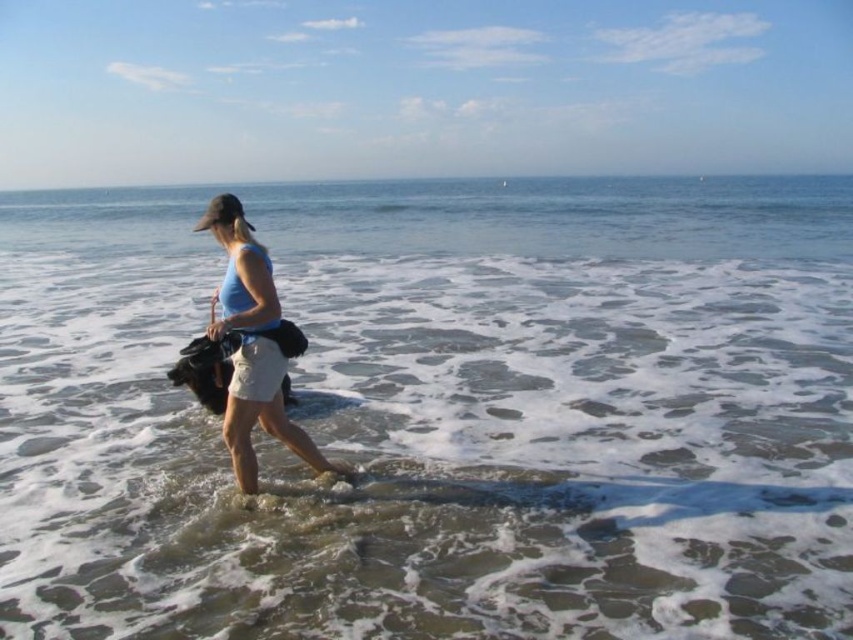
You are a photographer trying to capture a candid shot of the person walking on the beach. You need to ensure that both the clear water at center and the light beige cotton skirt at center are visible in the frame. Given their widths, which object will occupy more horizontal space in your photo?

The clear water at center will occupy more horizontal space in the photo because its width surpasses that of the light beige cotton skirt at center.

You are a photographer trying to capture the reflection of the person on the beach in your shot. The clear water at center is where the reflection is most visible. Given that the person is standing at point [440,413], which is the clear water at center, where should you position your camera to best capture the reflection?

To capture the reflection of the person on the beach, position your camera at the clear water at center where the person is standing at point [440,413], as that is where the reflection is most visible.